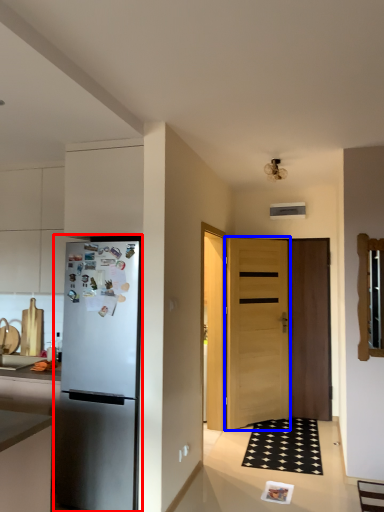
Question: Which point is further to the camera, refrigerator (highlighted by a red box) or door (highlighted by a blue box)?

Choices:
 (A) refrigerator
 (B) door

Answer: (B)